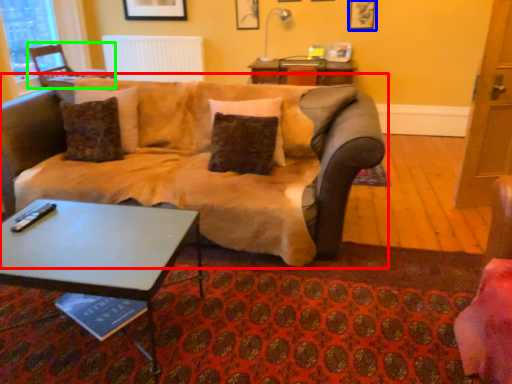
Question: Which is farther away from studio couch (highlighted by a red box)? picture frame (highlighted by a blue box) or chair (highlighted by a green box)?

Choices:
 (A) picture frame
 (B) chair

Answer: (A)